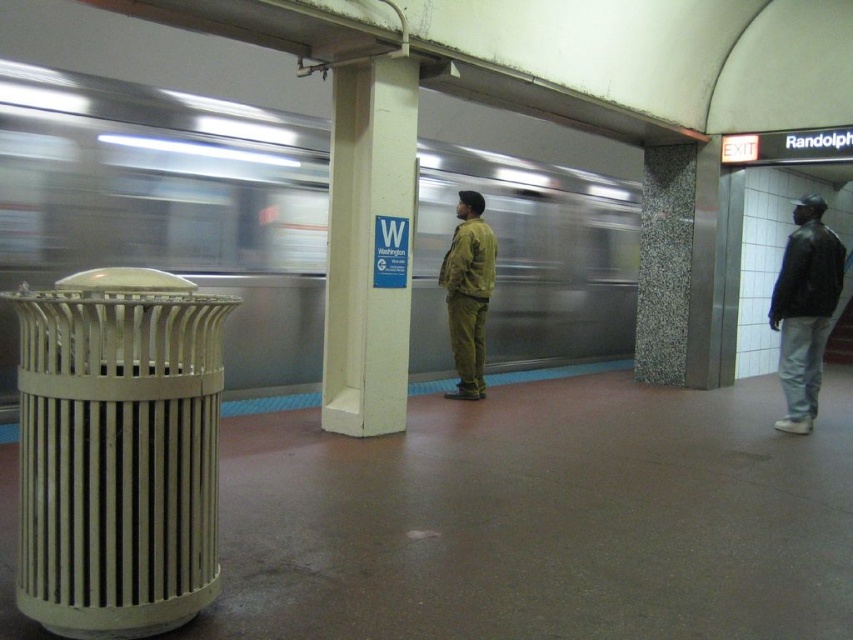
You are waiting for the train on the subway platform and notice a white concrete pillar at center and a black leather jacket at right. Which object is taller?

The white concrete pillar at center is much taller than the black leather jacket at right.

You are standing on the subway platform and want to know the exact coordinates of the metallic silver train at center. What are its coordinates?

The metallic silver train at center is located at coordinates point (171, 204).